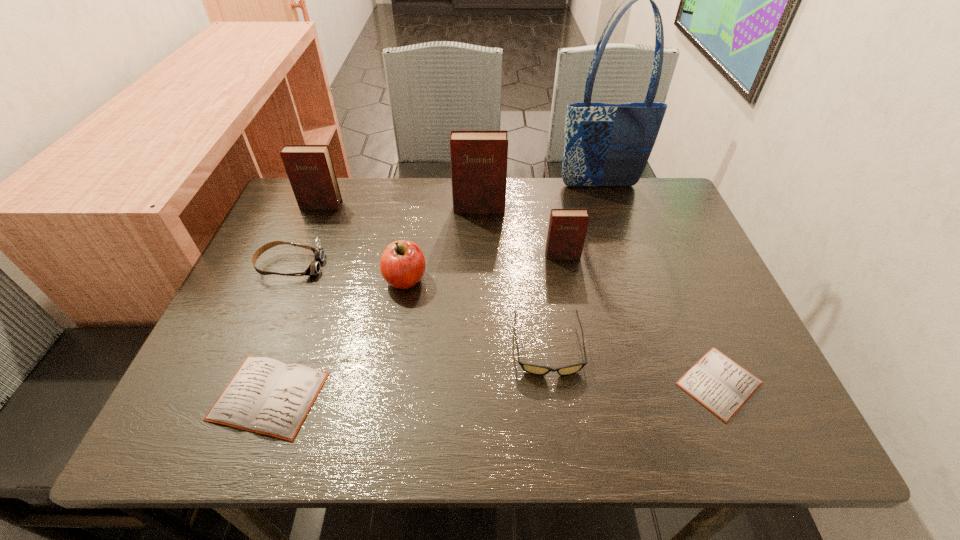
At what (x,y) coordinates should I click in order to perform the action: click on vacant point located between the sunglasses and the fourth diary from left to right. Please return your answer as a coordinate pair (x, y). This screenshot has width=960, height=540. Looking at the image, I should click on 555,301.

Locate an element on the screen. free spot between the biggest reddish-brown diary and the shopping bag is located at coordinates (540, 197).

This screenshot has width=960, height=540. I want to click on free space between the right white diary and the second reddish-brown diary from left to right, so click(599, 295).

Where is `empty space between the second biggest reddish-brown diary and the biggest reddish-brown diary`? The image size is (960, 540). empty space between the second biggest reddish-brown diary and the biggest reddish-brown diary is located at coordinates (399, 207).

At what (x,y) coordinates should I click in order to perform the action: click on free point between the eighth tallest object and the goggles. Please return your answer as a coordinate pair (x, y). This screenshot has height=540, width=960. Looking at the image, I should click on (279, 331).

The height and width of the screenshot is (540, 960). Identify the location of vacant area that lies between the third shortest object and the shortest object. (634, 365).

Find the location of a particular element. The height and width of the screenshot is (540, 960). free space that is in between the second reddish-brown diary from right to left and the sunglasses is located at coordinates (514, 278).

Where is `vacant point located between the sunglasses and the second smallest reddish-brown diary`? The height and width of the screenshot is (540, 960). vacant point located between the sunglasses and the second smallest reddish-brown diary is located at coordinates pos(435,276).

Image resolution: width=960 pixels, height=540 pixels. Identify the location of unoccupied position between the fourth diary from left to right and the shortest diary. (641, 319).

This screenshot has height=540, width=960. Identify the location of unoccupied area between the right white diary and the third farthest diary. (641, 319).